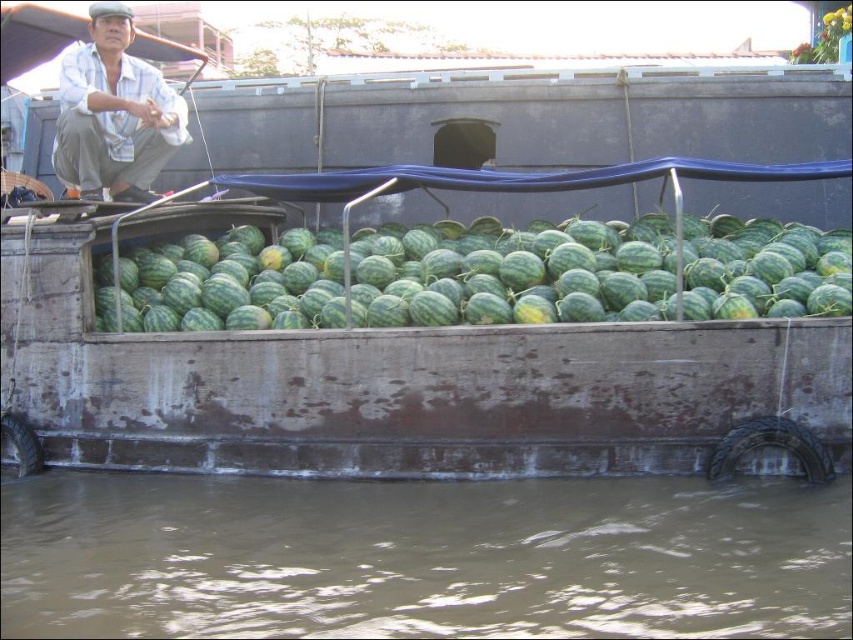
You are a delivery person who needs to pick up a watermelon from the boat. The boat is currently facing north. You are standing on the dock at the front of the boat. Which direction should you walk to reach the green matte watermelon at center without stepping on the white cotton shirt at upper left?

The green matte watermelon at center is positioned under the white cotton shirt at upper left. Since the boat is facing north and you are at the front, you should walk southward away from the front towards the center of the boat to reach the watermelon without stepping on the shirt.

You are standing on the dock and see the green matte watermelon at center and the white cotton shirt at upper left. Which object is positioned more to the right side of the scene?

The green matte watermelon at center is positioned more to the right than the white cotton shirt at upper left.

You are a delivery person who needs to load more watermelons onto the boat. Based on the current arrangement of the green matte watermelon at center and the white cotton shirt at upper left, which object takes up more space on the boat?

The white cotton shirt at upper left takes up more space than the green matte watermelon at center.